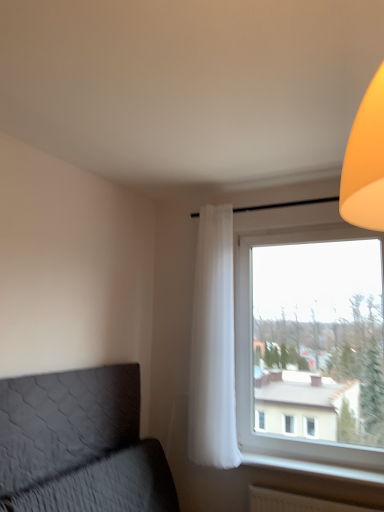
Question: From a real-world perspective, is transparent glass window at right positioned above or below white plastic radiator at lower right?

Choices:
 (A) below
 (B) above

Answer: (B)

Question: Is transparent glass window at right wider or thinner than white plastic radiator at lower right?

Choices:
 (A) thin
 (B) wide

Answer: (A)

Question: Based on their relative distances, which object is nearer to the dark gray quilted headboard at lower left?

Choices:
 (A) white plastic radiator at lower right
 (B) transparent glass window at right
 (C) white sheer curtain at center

Answer: (C)

Question: Which is nearer to the dark gray quilted headboard at lower left?

Choices:
 (A) transparent glass window at right
 (B) white plastic radiator at lower right
 (C) white sheer curtain at center

Answer: (C)